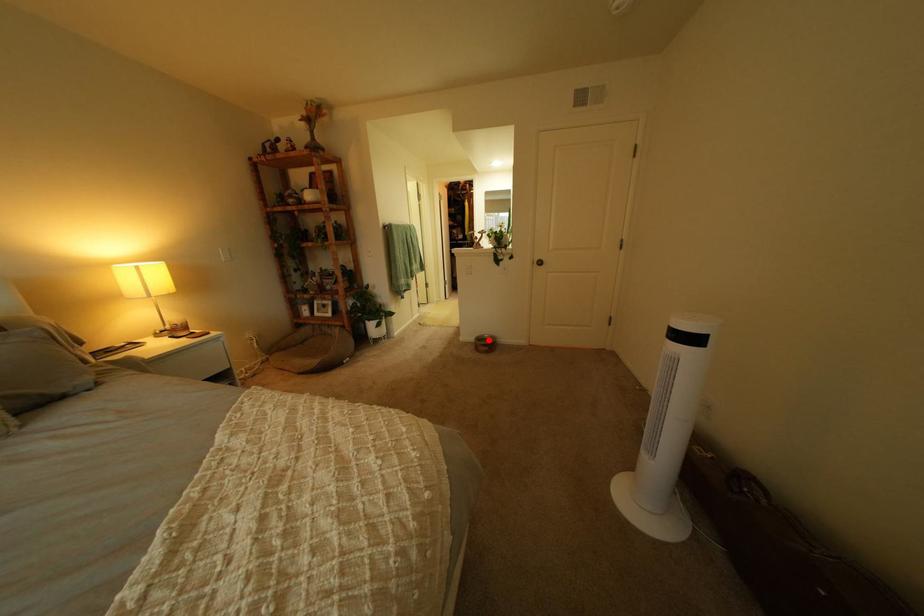
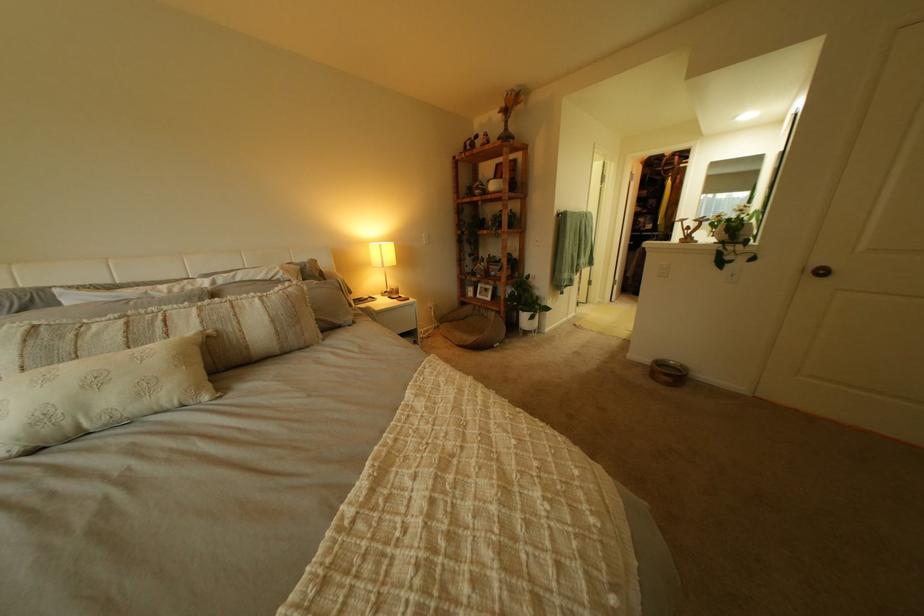
The point at the highlighted location is marked in the first image. Where is the corresponding point in the second image?

(663, 362)